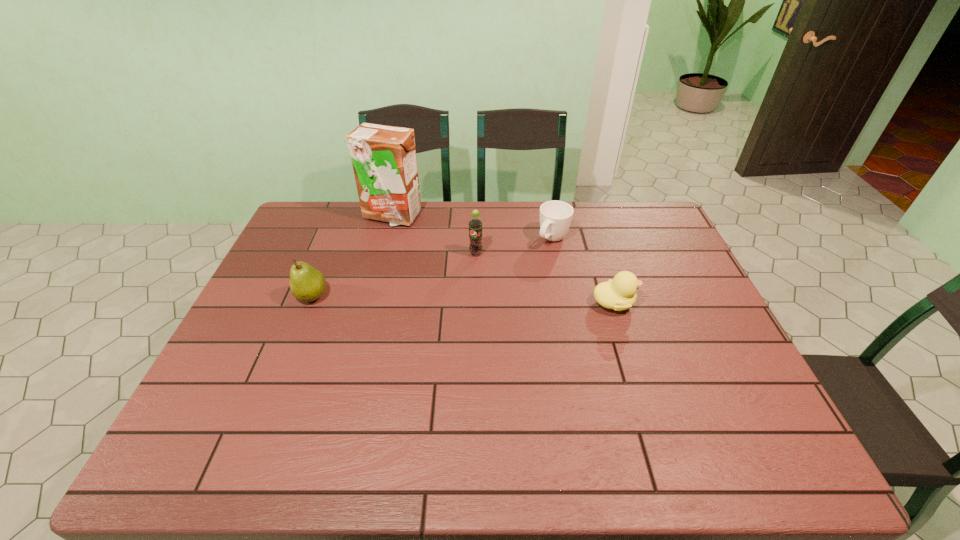
Identify the location of free spot between the fourth shortest object and the duckling. The image size is (960, 540). (545, 279).

Locate an element on the screen. The height and width of the screenshot is (540, 960). free spot between the pear and the tallest object is located at coordinates (352, 256).

Where is `unoccupied area between the fourth object from left to right and the duckling`? This screenshot has height=540, width=960. unoccupied area between the fourth object from left to right and the duckling is located at coordinates (584, 271).

What are the coordinates of `vacant point located between the fourth object from left to right and the third object from right to left` in the screenshot? It's located at pyautogui.click(x=515, y=247).

I want to click on free spot between the soda and the fourth object from left to right, so click(515, 247).

The image size is (960, 540). I want to click on vacant point located between the pear and the carton, so click(352, 256).

You are a GUI agent. You are given a task and a screenshot of the screen. Output one action in this format:
    pyautogui.click(x=<x>, y=<y>)
    Task: Click on the vacant space that is in between the third object from right to left and the leftmost object
    The width and height of the screenshot is (960, 540).
    Given the screenshot: What is the action you would take?
    pyautogui.click(x=394, y=275)

The image size is (960, 540). What are the coordinates of `object that ranks as the fourth closest to the tallest object` in the screenshot? It's located at (619, 294).

Identify the location of object that is the second closest one to the pear. (475, 223).

The width and height of the screenshot is (960, 540). Find the location of `vacant point that satisfies the following two spatial constraints: 1. on the back side of the fourth shortest object; 2. on the right side of the leftmost object`. vacant point that satisfies the following two spatial constraints: 1. on the back side of the fourth shortest object; 2. on the right side of the leftmost object is located at coordinates (329, 254).